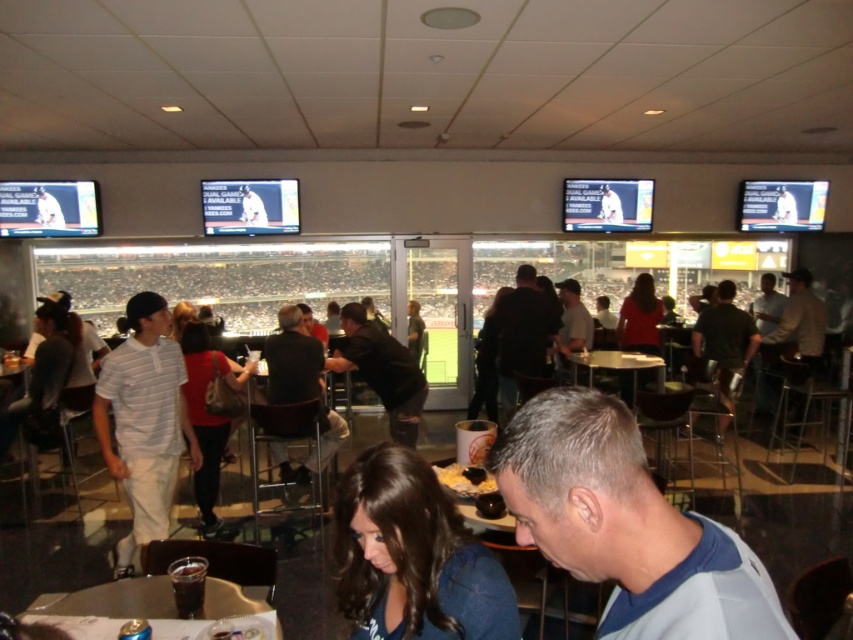
Question: Does gray fabric shirt at lower right have a larger size compared to dark blue sweater at lower center?

Choices:
 (A) no
 (B) yes

Answer: (A)

Question: Which object is the farthest from the metallic silver table at center?

Choices:
 (A) yellow cheesy dip at center
 (B) dark brown leather jacket at center
 (C) gray fabric shirt at lower right
 (D) black matte shirt at center

Answer: (C)

Question: Which of the following is the closest to the observer?

Choices:
 (A) (165, 307)
 (B) (300, 474)
 (C) (403, 579)

Answer: (C)

Question: Which of the following is the farthest from the observer?

Choices:
 (A) red shirt at center
 (B) dark blue sweater at lower center
 (C) black matte shirt at center
 (D) white striped polo shirt at center

Answer: (C)

Question: Is dark brown leather jacket at center positioned behind yellow cheesy dip at center?

Choices:
 (A) no
 (B) yes

Answer: (B)

Question: Can you confirm if dark blue sweater at lower center is positioned to the left of clear plastic cup at lower center?

Choices:
 (A) no
 (B) yes

Answer: (A)